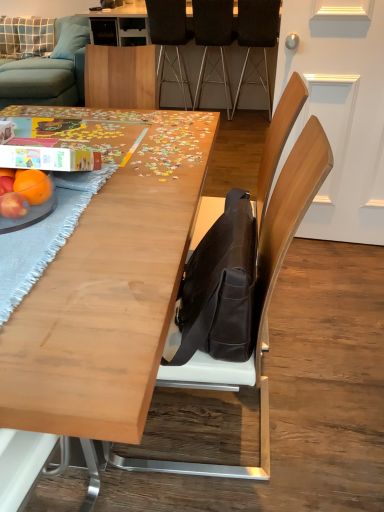
The height and width of the screenshot is (512, 384). What do you see at coordinates (49, 71) in the screenshot?
I see `light blue fabric couch at upper left` at bounding box center [49, 71].

What do you see at coordinates (26, 37) in the screenshot? I see `light blue fabric pillow at upper left, which appears as the second pillow when viewed from the right` at bounding box center [26, 37].

What do you see at coordinates (109, 286) in the screenshot? This screenshot has height=512, width=384. I see `light wood table at center, the first table when ordered from bottom to top` at bounding box center [109, 286].

Where is `matte orange at table left`? The width and height of the screenshot is (384, 512). matte orange at table left is located at coordinates (33, 185).

Locate an element on the screen. The image size is (384, 512). messenger bag above the brown leather chair at center, which is the 4th chair from back to front (from the image's perspective) is located at coordinates (218, 289).

Which of these two, matte black messenger bag at center or brown leather chair at center, which is the 1th chair from front to back, is bigger?

Bigger between the two is brown leather chair at center, which is the 1th chair from front to back.

What's the angular difference between matte black messenger bag at center and brown leather chair at center, which is the 4th chair from back to front,'s facing directions?

They differ by 0.00295 degrees in their facing directions.

From a real-world perspective, is matte black messenger bag at center over brown leather chair at center, which is the 1th chair from front to back?

Yes, from a real-world perspective, matte black messenger bag at center is on top of brown leather chair at center, which is the 1th chair from front to back.

Considering the relative positions of matte orange at table left and red matte apple at lower left, the 2th apple viewed from the front, in the image provided, is matte orange at table left to the right of red matte apple at lower left, the 2th apple viewed from the front, from the viewer's perspective?

Indeed, matte orange at table left is positioned on the right side of red matte apple at lower left, the 2th apple viewed from the front.

From the picture: Considering the positions of objects matte orange at table left and red matte apple at lower left, arranged as the 1th apple when viewed from the back, in the image provided, who is in front, matte orange at table left or red matte apple at lower left, arranged as the 1th apple when viewed from the back,?

Result: matte orange at table left is closer to the camera.

From the image's perspective, which one is positioned lower, matte orange at table left or red matte apple at lower left, arranged as the 1th apple when viewed from the back?

matte orange at table left is shown below in the image.

Based on their sizes in the image, would you say blue woven placemat at left is bigger or smaller than wooden puzzle at center, positioned as the first table in back-to-front order?

blue woven placemat at left is smaller than wooden puzzle at center, positioned as the first table in back-to-front order.

Is blue woven placemat at left in front of or behind wooden puzzle at center, positioned as the first table in back-to-front order, in the image?

blue woven placemat at left is in front of wooden puzzle at center, positioned as the first table in back-to-front order.

The image size is (384, 512). Find the location of `table behind the blue woven placemat at left`. table behind the blue woven placemat at left is located at coordinates (115, 20).

Is wooden puzzle at center, which appears as the second table when viewed from the front, completely or partially inside blue woven placemat at left?

No, blue woven placemat at left does not contain wooden puzzle at center, which appears as the second table when viewed from the front.

Which object is more forward, black fabric chair at center, the third chair when ordered from front to back, or light blue fabric pillow at upper left, which appears as the second pillow when viewed from the right?

black fabric chair at center, the third chair when ordered from front to back, is more forward.

What's the angular difference between black fabric chair at center, the third chair when ordered from front to back, and light blue fabric pillow at upper left, which appears as the second pillow when viewed from the right,'s facing directions?

The angle between the facing direction of black fabric chair at center, the third chair when ordered from front to back, and the facing direction of light blue fabric pillow at upper left, which appears as the second pillow when viewed from the right, is 178 degrees.

Is light blue fabric pillow at upper left, which appears as the second pillow when viewed from the right, at the back of black fabric chair at center, the third chair when ordered from front to back?

No, black fabric chair at center, the third chair when ordered from front to back,'s orientation is not away from light blue fabric pillow at upper left, which appears as the second pillow when viewed from the right.

Is point (207, 59) closer to camera compared to point (27, 42)?

Yes, point (207, 59) is in front of point (27, 42).

Starting from the light wood table at center, arranged as the second table when viewed from the back, which pillow is the 1st one behind? Please provide its 2D coordinates.

[(71, 41)]

Measure the distance between light wood table at center, arranged as the second table when viewed from the back, and blue fabric pillow at upper left, arranged as the 2th pillow when viewed from the left.

light wood table at center, arranged as the second table when viewed from the back, and blue fabric pillow at upper left, arranged as the 2th pillow when viewed from the left, are 4.57 meters apart from each other.

From a real-world perspective, does light wood table at center, the first table when ordered from bottom to top, sit lower than blue fabric pillow at upper left, acting as the 1th pillow starting from the right?

Indeed, from a real-world perspective, light wood table at center, the first table when ordered from bottom to top, is positioned beneath blue fabric pillow at upper left, acting as the 1th pillow starting from the right.

Measure the distance between dark brown leather chair at upper right, which ranks as the 2th chair in front-to-back order, and brown leather chair at center, which is the 1th chair from front to back.

They are 10.74 feet apart.

What's the angular difference between dark brown leather chair at upper right, which ranks as the 2th chair in front-to-back order, and brown leather chair at center, which is the 4th chair from back to front,'s facing directions?

91.9 degrees.

Who is taller, dark brown leather chair at upper right, which ranks as the 2th chair in front-to-back order, or brown leather chair at center, which is the 4th chair from back to front?

dark brown leather chair at upper right, which ranks as the 2th chair in front-to-back order, is taller.

Is point (240, 90) closer to camera compared to point (157, 462)?

That is False.

From a real-world perspective, is brown leather chair at center, which is the 4th chair from back to front, positioned under light blue fabric couch at upper left based on gravity?

No, from a real-world perspective, brown leather chair at center, which is the 4th chair from back to front, is not below light blue fabric couch at upper left.

Is point (262, 438) positioned behind point (45, 101)?

No, (262, 438) is closer to viewer.

Is brown leather chair at center, which is the 4th chair from back to front, oriented away from light blue fabric couch at upper left?

No, brown leather chair at center, which is the 4th chair from back to front,'s orientation is not away from light blue fabric couch at upper left.

This screenshot has height=512, width=384. Identify the location of messenger bag on the right of the brown leather chair at center, which is the 4th chair from back to front. (218, 289).

At what (x,y) coordinates should I click in order to perform the action: click on orange below the red matte apple at lower left, arranged as the 1th apple when viewed from the back (from the image's perspective). Please return your answer as a coordinate pair (x, y). Looking at the image, I should click on (33, 185).

From the image, which object appears to be farther from light blue fabric pillow at upper left, which appears as the second pillow when viewed from the right, light blue fabric couch at upper left or red matte apple at lower left, which is the 1th apple from front to back?

red matte apple at lower left, which is the 1th apple from front to back, is positioned further to the anchor light blue fabric pillow at upper left, which appears as the second pillow when viewed from the right.

Considering their positions, is blue fabric pillow at upper left, acting as the 1th pillow starting from the right, positioned closer to matte orange at table left than light wood table at center, placed as the second table when sorted from top to bottom?

light wood table at center, placed as the second table when sorted from top to bottom, lies closer to matte orange at table left than the other object.

Based on their spatial positions, is brown leather chair at center, which is the 4th chair from back to front, or blue woven placemat at left further from black fabric chair at center, the third chair when ordered from front to back?

Based on the image, brown leather chair at center, which is the 4th chair from back to front, appears to be further to black fabric chair at center, the third chair when ordered from front to back.

Considering their positions, is light blue fabric couch at upper left positioned closer to light blue fabric pillow at upper left, which appears as the second pillow when viewed from the right, than dark brown leather chair at upper right, placed as the 3th chair when sorted from back to front?

Based on the image, light blue fabric couch at upper left appears to be nearer to light blue fabric pillow at upper left, which appears as the second pillow when viewed from the right.

Which object lies further to the anchor point blue fabric pillow at upper left, acting as the 1th pillow starting from the right, brown leather chair at center, which is the 4th chair from back to front, or wooden puzzle at center, marked as the first table in a top-to-bottom arrangement?

Among the two, brown leather chair at center, which is the 4th chair from back to front, is located further to blue fabric pillow at upper left, acting as the 1th pillow starting from the right.

When comparing their distances from black leather chair at upper center, which is the first chair in back-to-front order, does red matte apple at lower left, which is the 1th apple from front to back, or wooden puzzle at center, which is the 2th table from bottom to top, seem closer?

wooden puzzle at center, which is the 2th table from bottom to top, is positioned closer to the anchor black leather chair at upper center, which is the first chair in back-to-front order.

Looking at the image, which one is located further to light blue fabric couch at upper left, red matte apple at lower left, the first apple viewed from the top, or red matte apple at lower left, positioned as the second apple in back-to-front order?

The object further to light blue fabric couch at upper left is red matte apple at lower left, positioned as the second apple in back-to-front order.

Based on their spatial positions, is red matte apple at lower left, positioned as the second apple in back-to-front order, or matte orange at table left closer to wooden puzzle at center, marked as the first table in a top-to-bottom arrangement?

Based on the image, matte orange at table left appears to be nearer to wooden puzzle at center, marked as the first table in a top-to-bottom arrangement.

The width and height of the screenshot is (384, 512). In order to click on place mat between light wood table at center, placed as the second table when sorted from top to bottom, and black leather chair at upper center, which is the 4th chair from front to back, from front to back in this screenshot , I will do `click(44, 236)`.

At what (x,y) coordinates should I click in order to perform the action: click on orange between light wood table at center, which appears as the 1th table when viewed from the front, and blue fabric pillow at upper left, arranged as the 2th pillow when viewed from the left, from front to back. Please return your answer as a coordinate pair (x, y). Image resolution: width=384 pixels, height=512 pixels. Looking at the image, I should click on (33, 185).

The image size is (384, 512). Identify the location of pillow between light wood table at center, placed as the second table when sorted from top to bottom, and light blue fabric pillow at upper left, the first pillow when ordered from left to right, from front to back. (71, 41).

This screenshot has height=512, width=384. What are the coordinates of `pillow between blue woven placemat at left and light blue fabric pillow at upper left, the first pillow when ordered from left to right, in the front-back direction` in the screenshot? It's located at (71, 41).